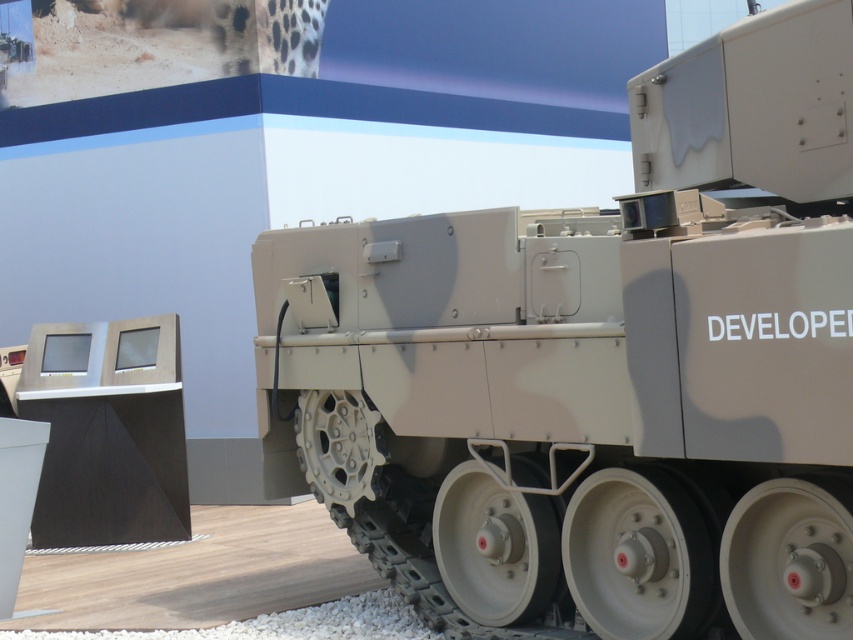
Question: Is camouflage paint tank at center to the left of black matte monitor at lower left from the viewer's perspective?

Choices:
 (A) no
 (B) yes

Answer: (A)

Question: Which object is closer to the camera taking this photo?

Choices:
 (A) camouflage paint tank at center
 (B) black matte monitor at lower left

Answer: (A)

Question: Which point is closer to the camera?

Choices:
 (A) camouflage paint tank at center
 (B) black matte monitor at lower left

Answer: (A)

Question: Does camouflage paint tank at center appear on the left side of black matte monitor at lower left?

Choices:
 (A) yes
 (B) no

Answer: (B)

Question: Is camouflage paint tank at center to the right of black matte monitor at lower left from the viewer's perspective?

Choices:
 (A) yes
 (B) no

Answer: (A)